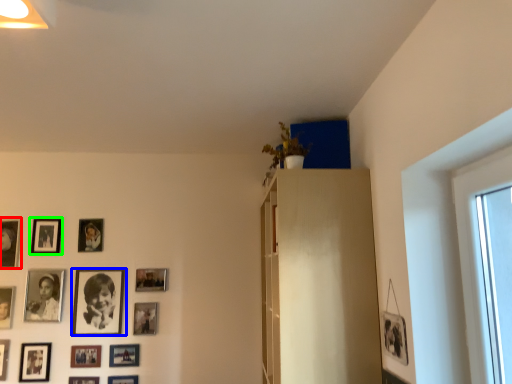
Question: Which object is positioned closest to picture frame (highlighted by a red box)? Select from picture frame (highlighted by a blue box) and picture frame (highlighted by a green box).

Choices:
 (A) picture frame
 (B) picture frame

Answer: (B)